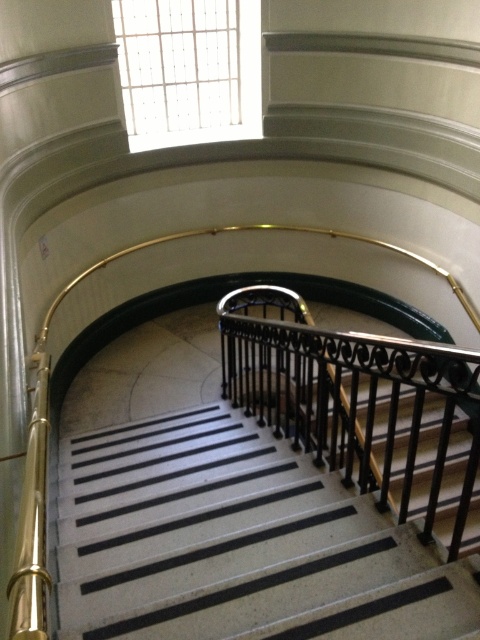
Question: Which point is closer to the camera?

Choices:
 (A) (379, 472)
 (B) (202, 458)

Answer: (B)

Question: Which point is farther from the camera taking this photo?

Choices:
 (A) (308, 432)
 (B) (159, 484)

Answer: (A)

Question: Does black textured stairs at center have a smaller size compared to black wrought iron at center?

Choices:
 (A) yes
 (B) no

Answer: (A)

Question: Which point is closer to the camera?

Choices:
 (A) black wrought iron at center
 (B) black textured stairs at center

Answer: (A)

Question: Considering the relative positions of black textured stairs at center and black wrought iron at center in the image provided, where is black textured stairs at center located with respect to black wrought iron at center?

Choices:
 (A) below
 (B) above

Answer: (A)

Question: Does black textured stairs at center come in front of black wrought iron at center?

Choices:
 (A) no
 (B) yes

Answer: (A)